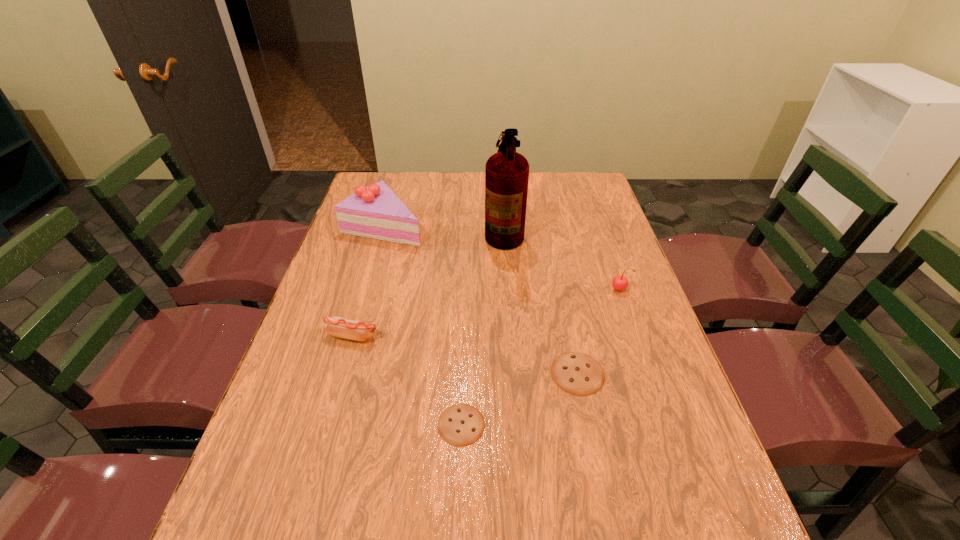
The width and height of the screenshot is (960, 540). Identify the location of the third tallest object. (620, 282).

Where is `blank area located on the right of the shorter cookie`? The height and width of the screenshot is (540, 960). blank area located on the right of the shorter cookie is located at coordinates (675, 424).

Locate an element on the screen. The width and height of the screenshot is (960, 540). blank area located on the left of the fifth tallest object is located at coordinates (379, 373).

Identify the location of free space located at the nozzle of the fire extinguisher. This screenshot has width=960, height=540. (443, 231).

This screenshot has width=960, height=540. In order to click on vacant position located 0.180m at the nozzle of the fire extinguisher in this screenshot , I will do `click(430, 231)`.

This screenshot has height=540, width=960. Identify the location of vacant space located at the nozzle of the fire extinguisher. (424, 231).

The image size is (960, 540). I want to click on free space located on the right of the second tallest object, so click(x=464, y=226).

The image size is (960, 540). I want to click on vacant area located 0.180m on the front of the sausage, so click(x=331, y=410).

You are a GUI agent. You are given a task and a screenshot of the screen. Output one action in this format:
    pyautogui.click(x=<x>, y=<y>)
    Task: Click on the vacant space located 0.280m on the left of the rightmost object
    
    Given the screenshot: What is the action you would take?
    pyautogui.click(x=512, y=290)

Image resolution: width=960 pixels, height=540 pixels. Find the location of `object at the far edge`. object at the far edge is located at coordinates (506, 172).